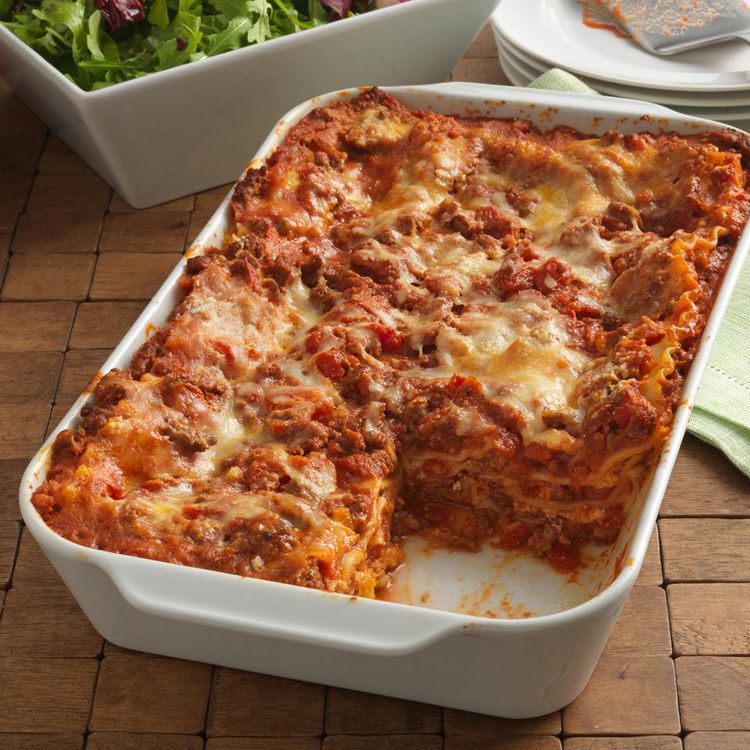
At what (x,y) coordinates should I click in order to perform the action: click on tabletop. Please return your answer as a coordinate pair (x, y). The height and width of the screenshot is (750, 750). Looking at the image, I should click on [x=721, y=610], [x=34, y=326].